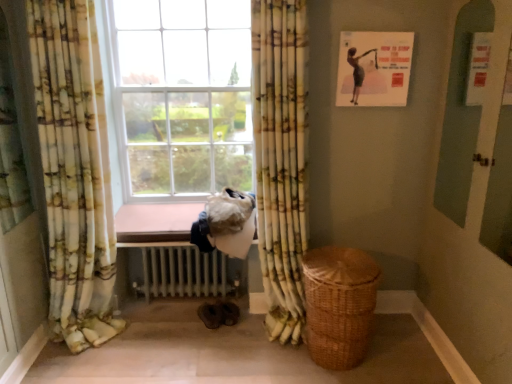
Question: Is yellow-green floral fabric curtain at center, positioned as the first curtain in right-to-left order, smaller than woven brown basket at lower right?

Choices:
 (A) no
 (B) yes

Answer: (A)

Question: Is woven brown basket at lower right located within yellow-green floral fabric curtain at center, which is the 2th curtain in left-to-right order?

Choices:
 (A) no
 (B) yes

Answer: (A)

Question: From the image's perspective, does yellow-green floral fabric curtain at center, positioned as the first curtain in right-to-left order, appear lower than woven brown basket at lower right?

Choices:
 (A) yes
 (B) no

Answer: (B)

Question: Can you confirm if yellow-green floral fabric curtain at center, positioned as the first curtain in right-to-left order, is wider than woven brown basket at lower right?

Choices:
 (A) no
 (B) yes

Answer: (A)

Question: Is yellow-green floral fabric curtain at center, positioned as the first curtain in right-to-left order, at the left side of woven brown basket at lower right?

Choices:
 (A) no
 (B) yes

Answer: (B)

Question: Is brown wooden window sill at center situated inside woven brown basket at lower right or outside?

Choices:
 (A) inside
 (B) outside

Answer: (B)

Question: Looking at their shapes, would you say brown wooden window sill at center is wider or thinner than woven brown basket at lower right?

Choices:
 (A) thin
 (B) wide

Answer: (B)

Question: Considering the relative positions of brown wooden window sill at center and woven brown basket at lower right in the image provided, is brown wooden window sill at center to the left or to the right of woven brown basket at lower right?

Choices:
 (A) left
 (B) right

Answer: (A)

Question: Considering the positions of point (131, 223) and point (340, 297), is point (131, 223) closer or farther from the camera than point (340, 297)?

Choices:
 (A) farther
 (B) closer

Answer: (A)

Question: Is brown wooden window sill at center inside or outside of floral fabric curtain at left, arranged as the second curtain when viewed from the right?

Choices:
 (A) inside
 (B) outside

Answer: (B)

Question: Is brown wooden window sill at center taller or shorter than floral fabric curtain at left, arranged as the second curtain when viewed from the right?

Choices:
 (A) short
 (B) tall

Answer: (A)

Question: From a real-world perspective, is brown wooden window sill at center above or below floral fabric curtain at left, which appears as the 1th curtain when viewed from the left?

Choices:
 (A) above
 (B) below

Answer: (B)

Question: Visually, is brown wooden window sill at center positioned to the left or to the right of floral fabric curtain at left, arranged as the second curtain when viewed from the right?

Choices:
 (A) right
 (B) left

Answer: (A)

Question: Relative to white metallic radiator at lower center, is yellow-green floral fabric curtain at center, which is the 2th curtain in left-to-right order, in front or behind?

Choices:
 (A) front
 (B) behind

Answer: (A)

Question: Is yellow-green floral fabric curtain at center, which is the 2th curtain in left-to-right order, situated inside white metallic radiator at lower center or outside?

Choices:
 (A) inside
 (B) outside

Answer: (B)